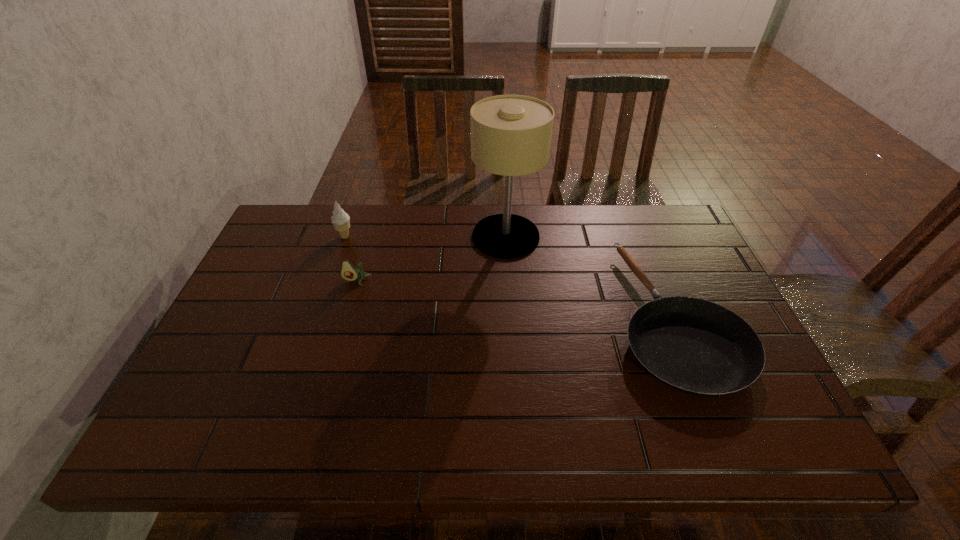
Where is `free space located on the seed side of the third tallest object`? free space located on the seed side of the third tallest object is located at coordinates (321, 405).

This screenshot has height=540, width=960. In order to click on blank space located on the left of the shortest object in this screenshot , I will do `click(515, 317)`.

Image resolution: width=960 pixels, height=540 pixels. I want to click on table lamp that is at the far edge, so click(x=511, y=135).

The width and height of the screenshot is (960, 540). I want to click on icecream positioned at the far edge, so click(x=341, y=221).

I want to click on object positioned at the right edge, so 698,347.

Image resolution: width=960 pixels, height=540 pixels. In the image, there is a desktop. In order to click on vacant space at the far edge in this screenshot , I will do `click(374, 206)`.

Locate an element on the screen. The image size is (960, 540). free space at the near edge of the desktop is located at coordinates (384, 431).

This screenshot has width=960, height=540. In the image, there is a desktop. Find the location of `free space at the left edge`. free space at the left edge is located at coordinates [262, 313].

Locate an element on the screen. This screenshot has width=960, height=540. vacant area at the right edge of the desktop is located at coordinates (741, 400).

In the image, there is a desktop. Where is `vacant space at the far left corner`? The image size is (960, 540). vacant space at the far left corner is located at coordinates (303, 236).